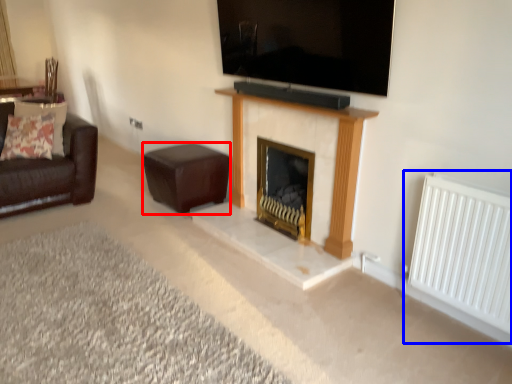
Question: Which of the following is the farthest to the observer, stool (highlighted by a red box) or radiator (highlighted by a blue box)?

Choices:
 (A) stool
 (B) radiator

Answer: (A)